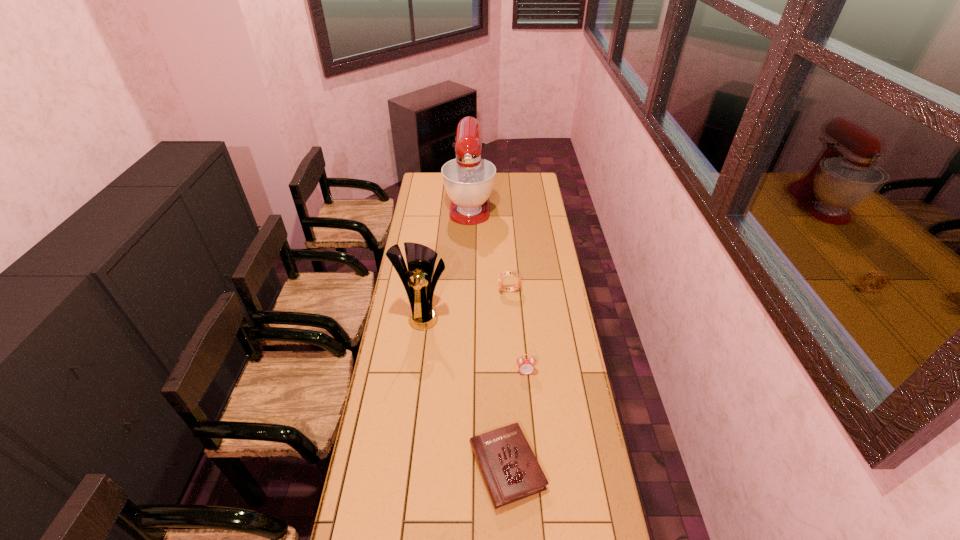
Identify which object is located as the third nearest to the nearest object. Please provide its 2D coordinates. Your answer should be formatted as a tuple, i.e. [(x, y)], where the tuple contains the x and y coordinates of a point satisfying the conditions above.

[(507, 273)]

I want to click on the third closest object relative to the third nearest object, so click(x=511, y=472).

Locate an element on the screen. The width and height of the screenshot is (960, 540). free spot that satisfies the following two spatial constraints: 1. on the face of the watch; 2. at the front of the award, where the globe is visible is located at coordinates (511, 315).

Where is `free spot that satisfies the following two spatial constraints: 1. at the front of the shortest object, where the globe is visible; 2. on the right side of the fourth shortest object`? The height and width of the screenshot is (540, 960). free spot that satisfies the following two spatial constraints: 1. at the front of the shortest object, where the globe is visible; 2. on the right side of the fourth shortest object is located at coordinates (403, 467).

Where is `vacant space that satisfies the following two spatial constraints: 1. at the attachment hub of the tallest object; 2. on the right side of the shortest object`? The width and height of the screenshot is (960, 540). vacant space that satisfies the following two spatial constraints: 1. at the attachment hub of the tallest object; 2. on the right side of the shortest object is located at coordinates (462, 467).